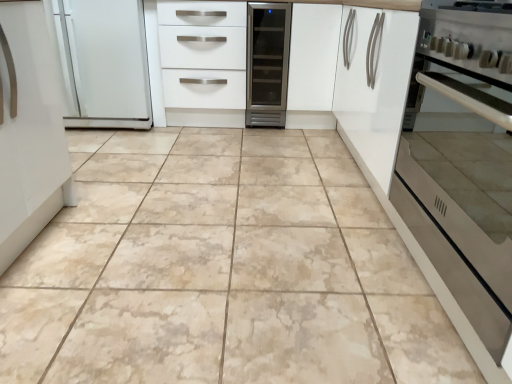
Question: Does point (337, 268) appear closer or farther from the camera than point (163, 33)?

Choices:
 (A) closer
 (B) farther

Answer: (A)

Question: In the image, is beige marble tile at center positioned in front of or behind white glossy drawers at center?

Choices:
 (A) front
 (B) behind

Answer: (A)

Question: Estimate the real-world distances between objects in this image. Which object is farther from the satin silver oven at right?

Choices:
 (A) white glossy drawers at center
 (B) beige marble tile at center
 (C) white matte cabinet at center

Answer: (A)

Question: Which of these objects is positioned closest to the white matte cabinet at center?

Choices:
 (A) satin silver oven at right
 (B) white glossy drawers at center
 (C) beige marble tile at center

Answer: (B)